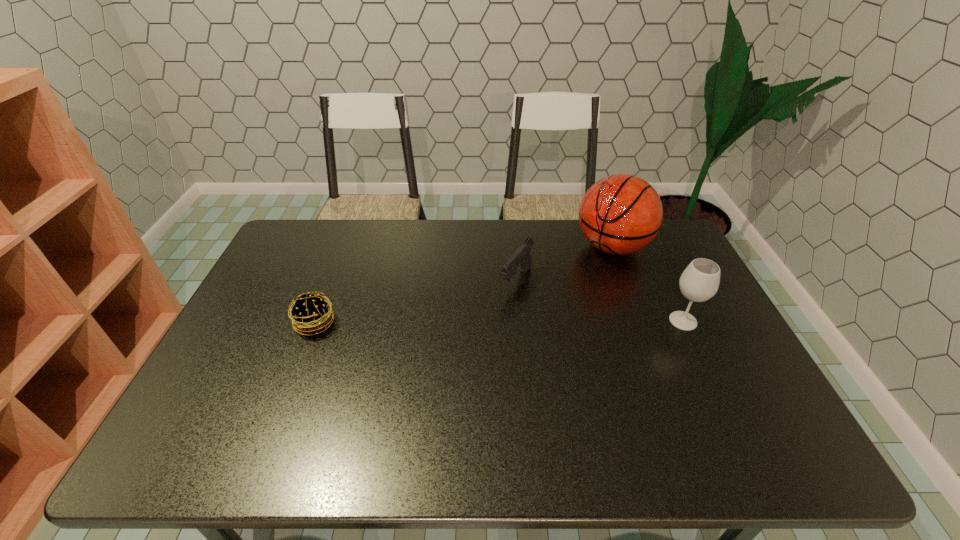
Locate an element on the screen. This screenshot has width=960, height=540. free region at the left edge of the desktop is located at coordinates (283, 342).

Where is `blank space at the right edge`? Image resolution: width=960 pixels, height=540 pixels. blank space at the right edge is located at coordinates (662, 300).

This screenshot has height=540, width=960. I want to click on blank space at the far left corner of the desktop, so click(289, 252).

In order to click on free spot at the near left corner of the desktop in this screenshot , I will do `click(213, 417)`.

Find the location of `vacant area that lies between the second object from left to right and the basketball`. vacant area that lies between the second object from left to right and the basketball is located at coordinates (564, 264).

What are the coordinates of `free space between the tallest object and the second tallest object` in the screenshot? It's located at (648, 284).

What are the coordinates of `free space that is in between the patty and the tallest object` in the screenshot? It's located at (464, 285).

Find the location of a particular element. free spot between the patty and the tallest object is located at coordinates (464, 285).

This screenshot has height=540, width=960. Identify the location of free point between the patty and the wineglass. (499, 322).

Image resolution: width=960 pixels, height=540 pixels. What are the coordinates of `free spot between the third object from right to left and the basketball` in the screenshot? It's located at (564, 264).